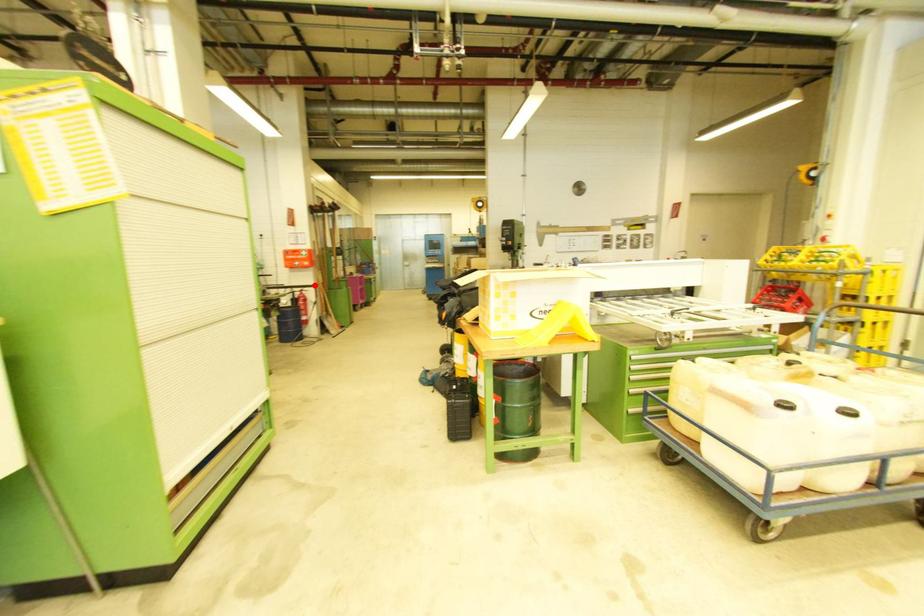
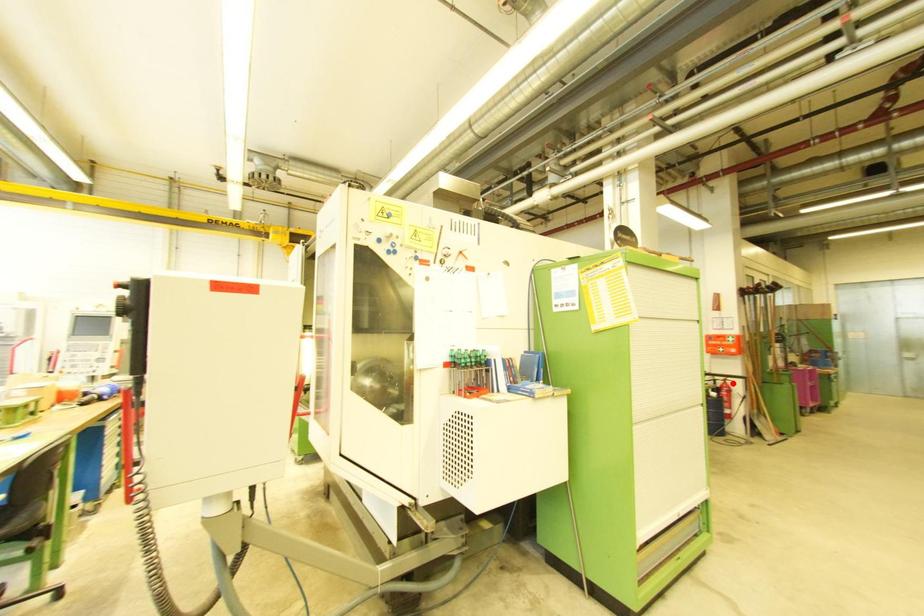
I am providing you with two images of the same scene from different viewpoints. A red point is marked on the first image and another point is marked on the second image. Is the marked point in image1 the same physical position as the marked point in image2?

No